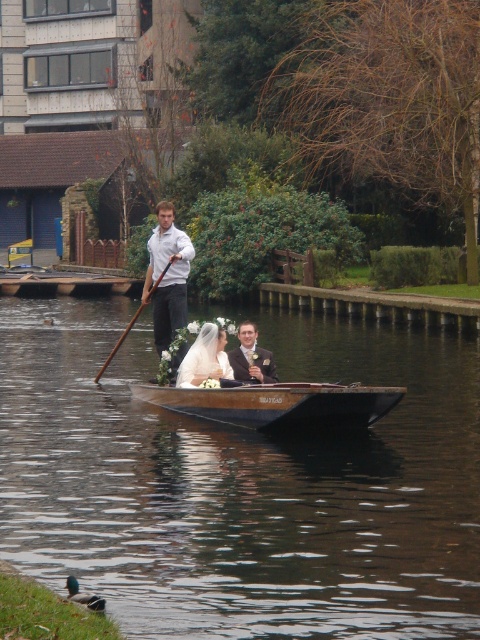
Between point (121, 588) and point (216, 365), which one is positioned in front?

Point (121, 588) is in front.

From the picture: Does brown wooden boat at center have a lesser width compared to white satin dress at center?

In fact, brown wooden boat at center might be wider than white satin dress at center.

At what (x,y) coordinates should I click in order to perform the action: click on brown wooden boat at center. Please return your answer as a coordinate pair (x, y). Image resolution: width=480 pixels, height=640 pixels. Looking at the image, I should click on (241, 483).

The height and width of the screenshot is (640, 480). What are the coordinates of `brown wooden boat at center` in the screenshot? It's located at (241, 483).

Who is shorter, brown wooden boat at center or brown wooden canoe at center?

brown wooden canoe at center is shorter.

How much distance is there between brown wooden boat at center and brown wooden canoe at center?

They are 10.34 feet apart.

Is point (432, 628) closer to viewer compared to point (215, 401)?

Yes, point (432, 628) is in front of point (215, 401).

Where is `brown wooden boat at center`? brown wooden boat at center is located at coordinates (241, 483).

Can you confirm if white satin dress at center is wider than matte black suit at center?

Indeed, white satin dress at center has a greater width compared to matte black suit at center.

Can you confirm if white satin dress at center is thinner than matte black suit at center?

No, white satin dress at center is not thinner than matte black suit at center.

At what (x,y) coordinates should I click in order to perform the action: click on white satin dress at center. Please return your answer as a coordinate pair (x, y). This screenshot has width=480, height=640. Looking at the image, I should click on (204, 356).

You are a GUI agent. You are given a task and a screenshot of the screen. Output one action in this format:
    pyautogui.click(x=<x>, y=<y>)
    Task: Click on the white satin dress at center
    
    Given the screenshot: What is the action you would take?
    pyautogui.click(x=204, y=356)